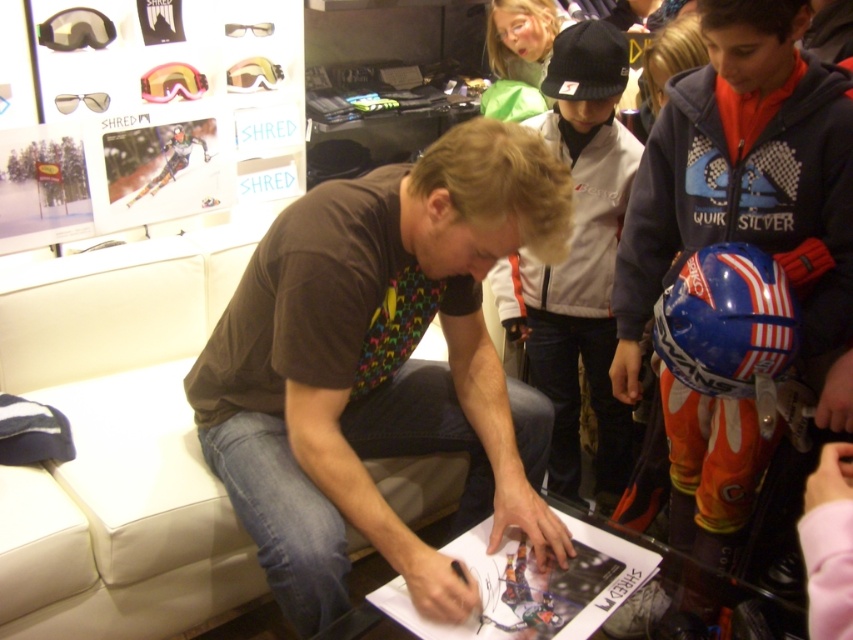
You are a photographer trying to capture a clear shot of the white paper at center without the matte black poster at upper left blocking the view. Based on their sizes, can you suggest a way to frame the shot?

The matte black poster at upper left is taller than the white paper at center. To avoid the poster blocking the view, position the camera lower so the poster is out of frame while still capturing the white paper at center.

You are a photographer standing at the center of the room. You want to take a photo of the brownmaterial shirt at center. What is the exact coordinate where you should aim your camera?

The exact coordinate to aim your camera is at point [381,365] where the brownmaterial shirt at center is located.